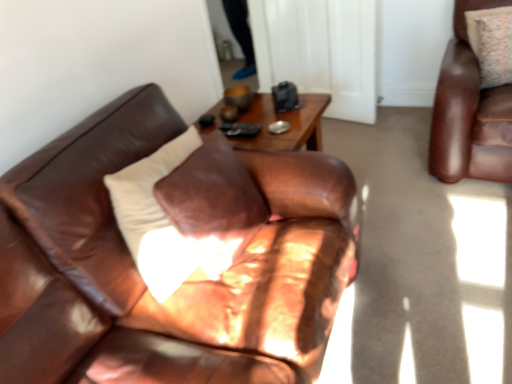
Question: Considering the relative sizes of transparent glass door at upper center and patterned fabric pillow at upper right in the image provided, is transparent glass door at upper center thinner than patterned fabric pillow at upper right?

Choices:
 (A) yes
 (B) no

Answer: (A)

Question: Does transparent glass door at upper center have a lesser height compared to patterned fabric pillow at upper right?

Choices:
 (A) no
 (B) yes

Answer: (A)

Question: Is patterned fabric pillow at upper right a part of transparent glass door at upper center?

Choices:
 (A) yes
 (B) no

Answer: (B)

Question: Considering the relative sizes of transparent glass door at upper center and patterned fabric pillow at upper right in the image provided, is transparent glass door at upper center wider than patterned fabric pillow at upper right?

Choices:
 (A) yes
 (B) no

Answer: (B)

Question: Is there a large distance between transparent glass door at upper center and patterned fabric pillow at upper right?

Choices:
 (A) no
 (B) yes

Answer: (A)

Question: Is transparent glass door at upper center positioned behind patterned fabric pillow at upper right?

Choices:
 (A) yes
 (B) no

Answer: (A)

Question: Is patterned fabric pillow at upper right taller than transparent glass door at upper center?

Choices:
 (A) yes
 (B) no

Answer: (B)

Question: Considering the relative sizes of patterned fabric pillow at upper right and transparent glass door at upper center in the image provided, is patterned fabric pillow at upper right thinner than transparent glass door at upper center?

Choices:
 (A) no
 (B) yes

Answer: (A)

Question: From the image's perspective, is patterned fabric pillow at upper right on top of transparent glass door at upper center?

Choices:
 (A) no
 (B) yes

Answer: (A)

Question: Can you confirm if patterned fabric pillow at upper right is smaller than transparent glass door at upper center?

Choices:
 (A) yes
 (B) no

Answer: (A)

Question: Is the depth of patterned fabric pillow at upper right greater than that of transparent glass door at upper center?

Choices:
 (A) yes
 (B) no

Answer: (B)

Question: Can you confirm if patterned fabric pillow at upper right is positioned to the right of transparent glass door at upper center?

Choices:
 (A) yes
 (B) no

Answer: (A)

Question: From the image's perspective, is transparent glass door at upper center on top of matte brown leather couch at center?

Choices:
 (A) no
 (B) yes

Answer: (B)